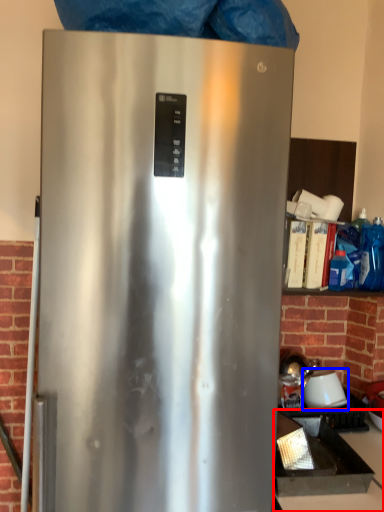
Question: Which object appears farthest to the camera in this image, counter top (highlighted by a red box) or appliance (highlighted by a blue box)?

Choices:
 (A) counter top
 (B) appliance

Answer: (B)